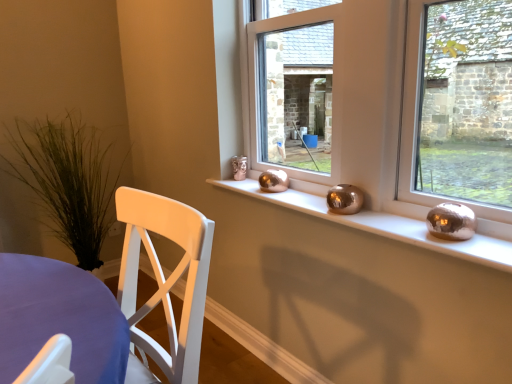
Image resolution: width=512 pixels, height=384 pixels. What do you see at coordinates (383, 225) in the screenshot?
I see `metallic spheres at center` at bounding box center [383, 225].

Describe the element at coordinates (67, 181) in the screenshot. This screenshot has height=384, width=512. I see `green grass at left` at that location.

This screenshot has height=384, width=512. I want to click on metallic gold vase at center, so click(x=290, y=90).

Considering the positions of objects metallic spheres at center and metallic gold vase at center in the image provided, who is more to the left, metallic spheres at center or metallic gold vase at center?

metallic gold vase at center.

From a real-world perspective, relative to metallic gold vase at center, is metallic spheres at center vertically above or below?

In terms of real-world spatial position, metallic spheres at center is below metallic gold vase at center.

Does metallic spheres at center have a greater width compared to metallic gold vase at center?

Indeed, metallic spheres at center has a greater width compared to metallic gold vase at center.

Would you consider metallic spheres at center to be distant from metallic gold vase at center?

That's not correct — metallic spheres at center is a little close to metallic gold vase at center.

Can you tell me how much metallic gold vase at center and green grass at left differ in facing direction?

They differ by 90.2 degrees in their facing directions.

Can you confirm if metallic gold vase at center is bigger than green grass at left?

Actually, metallic gold vase at center might be smaller than green grass at left.

From the image's perspective, between metallic gold vase at center and green grass at left, who is located below?

green grass at left.

Is the surface of metallic gold vase at center in direct contact with green grass at left?

They are not placed beside each other.

Considering the sizes of green grass at left and metallic gold vase at center in the image, is green grass at left wider or thinner than metallic gold vase at center?

Considering their sizes, green grass at left looks broader than metallic gold vase at center.

From a real-world perspective, is green grass at left physically above metallic gold vase at center?

Actually, green grass at left is physically below metallic gold vase at center in the real world.

From the picture: Is green grass at left positioned before metallic gold vase at center?

No.

From their relative heights in the image, would you say green grass at left is taller or shorter than metallic gold vase at center?

Considering their sizes, green grass at left has more height than metallic gold vase at center.

From a real-world perspective, is green grass at left physically below metallic spheres at center?

Correct, in the physical world, green grass at left is lower than metallic spheres at center.

Which is nearer, (102, 221) or (390, 230)?

Clearly, point (102, 221) is more distant from the camera than point (390, 230).

From the image's perspective, is green grass at left under metallic spheres at center?

Incorrect, from the image's perspective, green grass at left is higher than metallic spheres at center.

Is green grass at left at the left side of metallic spheres at center?

Yes.

Considering the positions of objects metallic spheres at center and green grass at left in the image provided, who is more to the left, metallic spheres at center or green grass at left?

Positioned to the left is green grass at left.

From the picture: Considering the sizes of objects metallic spheres at center and green grass at left in the image provided, who is thinner, metallic spheres at center or green grass at left?

Thinner between the two is metallic spheres at center.

Between point (298, 201) and point (96, 153), which one is positioned behind?

The point (96, 153) is farther.

From a real-world perspective, is metallic spheres at center physically located above or below green grass at left?

Clearly, from a real-world perspective, metallic spheres at center is above green grass at left.

Does metallic gold vase at center lie behind metallic spheres at center?

Yes.

From a real-world perspective, is metallic gold vase at center over metallic spheres at center?

Correct, in the physical world, metallic gold vase at center is higher than metallic spheres at center.

Is metallic gold vase at center facing towards metallic spheres at center?

Yes, metallic gold vase at center is facing metallic spheres at center.

Is metallic gold vase at center not close to metallic spheres at center?

No, metallic gold vase at center is not far from metallic spheres at center.

In the image, there is a metallic gold vase at center. What are the coordinates of `window sill below it (from a real-world perspective)` in the screenshot? It's located at (383, 225).

Image resolution: width=512 pixels, height=384 pixels. In order to click on window in front of the green grass at left in this screenshot , I will do `click(290, 90)`.

Looking at the image, which one is located further to green grass at left, metallic spheres at center or metallic gold vase at center?

metallic gold vase at center is positioned further to the anchor green grass at left.

From the image, which object appears to be farther from metallic gold vase at center, green grass at left or metallic spheres at center?

green grass at left.

From the picture: Looking at the image, which one is located further to metallic gold vase at center, metallic spheres at center or green grass at left?

Among the two, green grass at left is located further to metallic gold vase at center.

Looking at the image, which one is located further to green grass at left, metallic gold vase at center or metallic spheres at center?

metallic gold vase at center is further to green grass at left.

Based on their spatial positions, is metallic gold vase at center or green grass at left closer to metallic spheres at center?

Among the two, metallic gold vase at center is located nearer to metallic spheres at center.

Looking at this image, considering their positions, is green grass at left positioned further to metallic spheres at center than metallic gold vase at center?

Among the two, green grass at left is located further to metallic spheres at center.

This screenshot has width=512, height=384. Find the location of `window between green grass at left and metallic spheres at center in the horizontal direction`. window between green grass at left and metallic spheres at center in the horizontal direction is located at coordinates (290, 90).